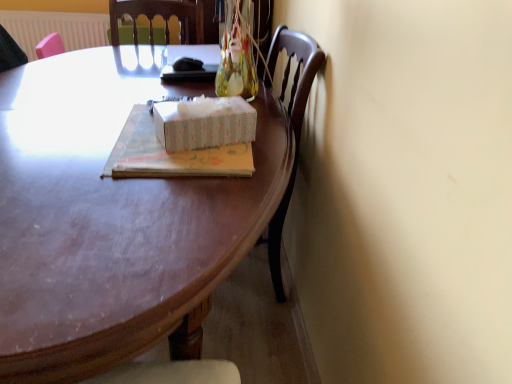
Question: Considering the relative positions of white textured radiator at upper left and white paper tissue box at center in the image provided, is white textured radiator at upper left to the left or to the right of white paper tissue box at center?

Choices:
 (A) left
 (B) right

Answer: (A)

Question: From a real-world perspective, relative to white paper tissue box at center, is white textured radiator at upper left vertically above or below?

Choices:
 (A) below
 (B) above

Answer: (A)

Question: Estimate the real-world distances between objects in this image. Which object is closer to the white textured radiator at upper left?

Choices:
 (A) white paper tissue box at center
 (B) matte paper book at center
 (C) shiny brown desk at center

Answer: (C)

Question: Which is farther from the shiny brown desk at center?

Choices:
 (A) matte paper book at center
 (B) white paper tissue box at center
 (C) white textured radiator at upper left

Answer: (C)